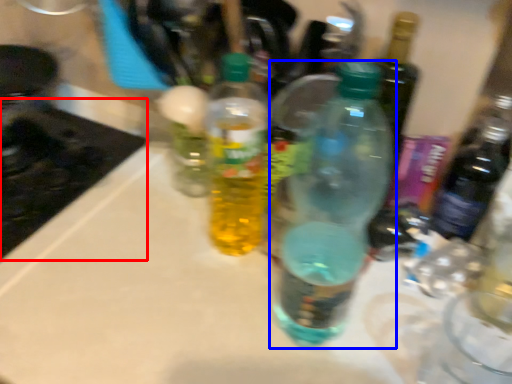
Question: Which object is closer to the camera taking this photo, appliance (highlighted by a red box) or bottle (highlighted by a blue box)?

Choices:
 (A) appliance
 (B) bottle

Answer: (B)